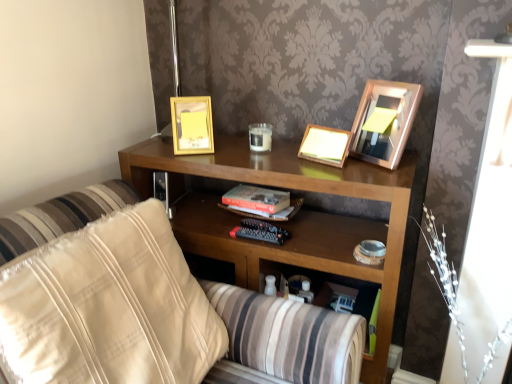
The height and width of the screenshot is (384, 512). Describe the element at coordinates (108, 307) in the screenshot. I see `beige fabric pillow at left` at that location.

What are the coordinates of `beige fabric pillow at left` in the screenshot? It's located at (108, 307).

What is the approximate height of wooden picture frame at center, the second picture frame viewed from the right?

The height of wooden picture frame at center, the second picture frame viewed from the right, is 10.46 centimeters.

Based on the photo, measure the distance between wooden picture frame at center, which is counted as the 2th picture frame, starting from the left, and camera.

wooden picture frame at center, which is counted as the 2th picture frame, starting from the left, is 3.88 feet from camera.

Measure the distance between gold metallic picture frame at upper center, which ranks as the 1th picture frame in left-to-right order, and camera.

gold metallic picture frame at upper center, which ranks as the 1th picture frame in left-to-right order, and camera are 4.30 feet apart from each other.

What do you see at coordinates (288, 222) in the screenshot? I see `wooden shelf at center` at bounding box center [288, 222].

Where is `wooden shelf at center`? wooden shelf at center is located at coordinates coord(288,222).

The height and width of the screenshot is (384, 512). Identify the location of gold metallic picture frame at upper right, the 1th picture frame from the right. (384, 121).

Is wooden picture frame at center, which is counted as the 2th picture frame, starting from the left, spatially inside beige fabric pillow at left, or outside of it?

wooden picture frame at center, which is counted as the 2th picture frame, starting from the left, lies outside beige fabric pillow at left.

Looking at this image, between wooden picture frame at center, which is counted as the 2th picture frame, starting from the left, and beige fabric pillow at left, which one has larger width?

With larger width is beige fabric pillow at left.

Is wooden picture frame at center, which is counted as the 2th picture frame, starting from the left, positioned far away from beige fabric pillow at left?

No, wooden picture frame at center, which is counted as the 2th picture frame, starting from the left, is not far from beige fabric pillow at left.

How distant is wooden picture frame at center, which is counted as the 2th picture frame, starting from the left, from beige fabric pillow at left?

The distance of wooden picture frame at center, which is counted as the 2th picture frame, starting from the left, from beige fabric pillow at left is 24.69 inches.

Based on the photo, would you say gold metallic picture frame at upper right, the 1th picture frame from the right, is a long distance from gold metallic picture frame at upper center, which ranks as the 1th picture frame in left-to-right order?

Actually, gold metallic picture frame at upper right, the 1th picture frame from the right, and gold metallic picture frame at upper center, which ranks as the 1th picture frame in left-to-right order, are a little close together.

Is gold metallic picture frame at upper right, the 1th picture frame from the right, turned away from gold metallic picture frame at upper center, acting as the third picture frame starting from the right?

No, gold metallic picture frame at upper right, the 1th picture frame from the right, is not facing away from gold metallic picture frame at upper center, acting as the third picture frame starting from the right.

Is gold metallic picture frame at upper right, the 1th picture frame from the right, not inside gold metallic picture frame at upper center, which ranks as the 1th picture frame in left-to-right order?

Yes.

What's the angular difference between wooden picture frame at center, the second picture frame viewed from the right, and gold metallic picture frame at upper center, which ranks as the 1th picture frame in left-to-right order,'s facing directions?

The angle between the facing direction of wooden picture frame at center, the second picture frame viewed from the right, and the facing direction of gold metallic picture frame at upper center, which ranks as the 1th picture frame in left-to-right order, is 50.8 degrees.

From the picture: From a real-world perspective, which is physically below, wooden picture frame at center, the second picture frame viewed from the right, or gold metallic picture frame at upper center, which ranks as the 1th picture frame in left-to-right order?

In real-world perspective, wooden picture frame at center, the second picture frame viewed from the right, is lower.

Considering the sizes of wooden picture frame at center, the second picture frame viewed from the right, and gold metallic picture frame at upper center, acting as the third picture frame starting from the right, in the image, is wooden picture frame at center, the second picture frame viewed from the right, bigger or smaller than gold metallic picture frame at upper center, acting as the third picture frame starting from the right,?

Considering their sizes, wooden picture frame at center, the second picture frame viewed from the right, takes up less space than gold metallic picture frame at upper center, acting as the third picture frame starting from the right.

From a real-world perspective, is gold metallic picture frame at upper center, acting as the third picture frame starting from the right, located higher than wooden picture frame at center, which is counted as the 2th picture frame, starting from the left?

Correct, in the physical world, gold metallic picture frame at upper center, acting as the third picture frame starting from the right, is higher than wooden picture frame at center, which is counted as the 2th picture frame, starting from the left.

Which of these two, gold metallic picture frame at upper center, acting as the third picture frame starting from the right, or wooden picture frame at center, which is counted as the 2th picture frame, starting from the left, is bigger?

gold metallic picture frame at upper center, acting as the third picture frame starting from the right, is bigger.

Is gold metallic picture frame at upper center, acting as the third picture frame starting from the right, positioned before wooden picture frame at center, which is counted as the 2th picture frame, starting from the left?

No.

Considering the sizes of gold metallic picture frame at upper center, which ranks as the 1th picture frame in left-to-right order, and wooden picture frame at center, the second picture frame viewed from the right, in the image, is gold metallic picture frame at upper center, which ranks as the 1th picture frame in left-to-right order, wider or thinner than wooden picture frame at center, the second picture frame viewed from the right,?

gold metallic picture frame at upper center, which ranks as the 1th picture frame in left-to-right order, is wider than wooden picture frame at center, the second picture frame viewed from the right.

From a real-world perspective, is gold metallic picture frame at upper right, arranged as the 3th picture frame when viewed from the left, located higher than wooden shelf at center?

Yes, from a real-world perspective, gold metallic picture frame at upper right, arranged as the 3th picture frame when viewed from the left, is on top of wooden shelf at center.

From the image's perspective, does gold metallic picture frame at upper right, arranged as the 3th picture frame when viewed from the left, appear lower than wooden shelf at center?

Incorrect, from the image's perspective, gold metallic picture frame at upper right, arranged as the 3th picture frame when viewed from the left, is higher than wooden shelf at center.

Would you say gold metallic picture frame at upper right, arranged as the 3th picture frame when viewed from the left, is outside wooden shelf at center?

gold metallic picture frame at upper right, arranged as the 3th picture frame when viewed from the left, is positioned outside wooden shelf at center.

Considering the points (382, 94) and (300, 242), which point is in front, point (382, 94) or point (300, 242)?

Point (382, 94)

What's the angular difference between wooden picture frame at center, which is counted as the 2th picture frame, starting from the left, and gold metallic picture frame at upper right, the 1th picture frame from the right,'s facing directions?

The angle between the facing direction of wooden picture frame at center, which is counted as the 2th picture frame, starting from the left, and the facing direction of gold metallic picture frame at upper right, the 1th picture frame from the right, is 14 degrees.

From a real-world perspective, is wooden picture frame at center, which is counted as the 2th picture frame, starting from the left, on top of gold metallic picture frame at upper right, arranged as the 3th picture frame when viewed from the left?

No, from a real-world perspective, wooden picture frame at center, which is counted as the 2th picture frame, starting from the left, is not above gold metallic picture frame at upper right, arranged as the 3th picture frame when viewed from the left.

Is wooden picture frame at center, which is counted as the 2th picture frame, starting from the left, touching gold metallic picture frame at upper right, the 1th picture frame from the right?

No, wooden picture frame at center, which is counted as the 2th picture frame, starting from the left, is not touching gold metallic picture frame at upper right, the 1th picture frame from the right.

Considering the sizes of objects beige fabric pillow at left and wooden picture frame at center, the second picture frame viewed from the right, in the image provided, who is bigger, beige fabric pillow at left or wooden picture frame at center, the second picture frame viewed from the right,?

Bigger between the two is beige fabric pillow at left.

Considering the sizes of objects beige fabric pillow at left and wooden picture frame at center, which is counted as the 2th picture frame, starting from the left, in the image provided, who is taller, beige fabric pillow at left or wooden picture frame at center, which is counted as the 2th picture frame, starting from the left,?

With more height is beige fabric pillow at left.

Is beige fabric pillow at left surrounding wooden picture frame at center, the second picture frame viewed from the right?

Actually, wooden picture frame at center, the second picture frame viewed from the right, is outside beige fabric pillow at left.

I want to click on pillow lying on the left of wooden picture frame at center, the second picture frame viewed from the right, so click(x=108, y=307).

Starting from the gold metallic picture frame at upper center, which ranks as the 1th picture frame in left-to-right order, which picture frame is the 2nd one in front? Please provide its 2D coordinates.

[(384, 121)]

Considering their positions, is gold metallic picture frame at upper center, which ranks as the 1th picture frame in left-to-right order, positioned closer to gold metallic picture frame at upper right, the 1th picture frame from the right, than wooden shelf at center?

Based on the image, wooden shelf at center appears to be nearer to gold metallic picture frame at upper right, the 1th picture frame from the right.

In the scene shown: Based on their spatial positions, is wooden shelf at center or gold metallic picture frame at upper right, arranged as the 3th picture frame when viewed from the left, closer to beige fabric pillow at left?

wooden shelf at center lies closer to beige fabric pillow at left than the other object.

Looking at the image, which one is located closer to beige fabric pillow at left, gold metallic picture frame at upper right, the 1th picture frame from the right, or gold metallic picture frame at upper center, acting as the third picture frame starting from the right?

The object closer to beige fabric pillow at left is gold metallic picture frame at upper center, acting as the third picture frame starting from the right.

Considering their positions, is beige fabric pillow at left positioned closer to wooden picture frame at center, which is counted as the 2th picture frame, starting from the left, than gold metallic picture frame at upper right, arranged as the 3th picture frame when viewed from the left?

gold metallic picture frame at upper right, arranged as the 3th picture frame when viewed from the left, is positioned closer to the anchor wooden picture frame at center, which is counted as the 2th picture frame, starting from the left.

Considering their positions, is wooden shelf at center positioned closer to gold metallic picture frame at upper center, acting as the third picture frame starting from the right, than wooden picture frame at center, which is counted as the 2th picture frame, starting from the left?

wooden shelf at center lies closer to gold metallic picture frame at upper center, acting as the third picture frame starting from the right, than the other object.

Based on their spatial positions, is gold metallic picture frame at upper right, arranged as the 3th picture frame when viewed from the left, or beige fabric pillow at left closer to wooden shelf at center?

Based on the image, gold metallic picture frame at upper right, arranged as the 3th picture frame when viewed from the left, appears to be nearer to wooden shelf at center.

Which object lies further to the anchor point wooden shelf at center, wooden picture frame at center, which is counted as the 2th picture frame, starting from the left, or gold metallic picture frame at upper center, which ranks as the 1th picture frame in left-to-right order?

Based on the image, gold metallic picture frame at upper center, which ranks as the 1th picture frame in left-to-right order, appears to be further to wooden shelf at center.

Which object lies nearer to the anchor point wooden shelf at center, wooden picture frame at center, which is counted as the 2th picture frame, starting from the left, or gold metallic picture frame at upper right, arranged as the 3th picture frame when viewed from the left?

The object closer to wooden shelf at center is wooden picture frame at center, which is counted as the 2th picture frame, starting from the left.

Locate an element on the screen. This screenshot has height=384, width=512. shelf located between beige fabric pillow at left and gold metallic picture frame at upper center, which ranks as the 1th picture frame in left-to-right order, in the depth direction is located at coordinates (288, 222).

Image resolution: width=512 pixels, height=384 pixels. Find the location of `picture frame that lies between gold metallic picture frame at upper center, acting as the third picture frame starting from the right, and wooden shelf at center from top to bottom`. picture frame that lies between gold metallic picture frame at upper center, acting as the third picture frame starting from the right, and wooden shelf at center from top to bottom is located at coordinates (324, 145).

Identify the location of shelf between beige fabric pillow at left and wooden picture frame at center, which is counted as the 2th picture frame, starting from the left, in the front-back direction. This screenshot has width=512, height=384. (288, 222).

Find the location of a particular element. This screenshot has width=512, height=384. shelf between beige fabric pillow at left and gold metallic picture frame at upper right, the 1th picture frame from the right is located at coordinates (288, 222).